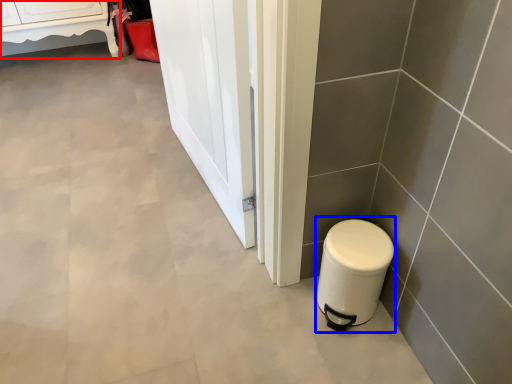
Question: Which point is further to the camera, furniture (highlighted by a red box) or appliance (highlighted by a blue box)?

Choices:
 (A) furniture
 (B) appliance

Answer: (A)